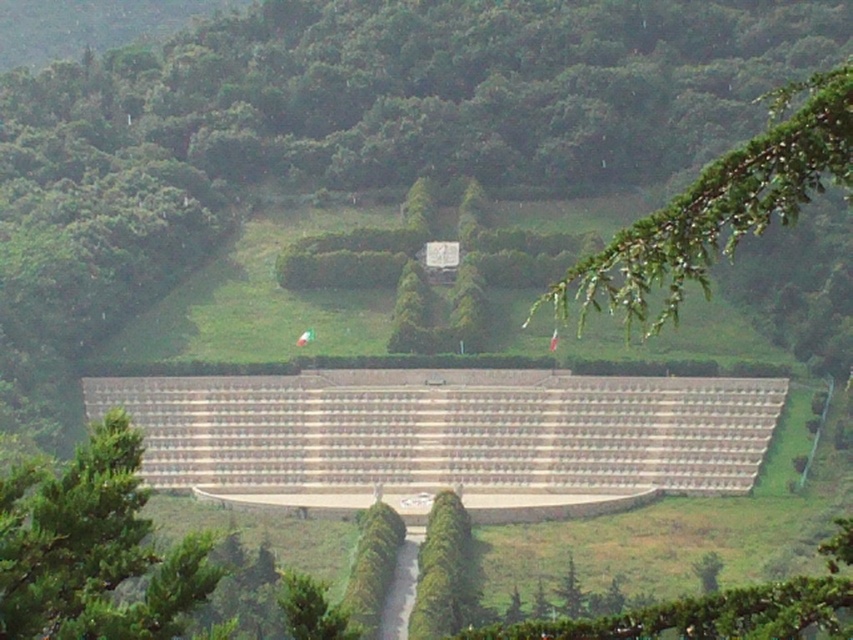
Question: Can you confirm if green needle-like leaves at upper right is positioned above green leafy tree at center?

Choices:
 (A) yes
 (B) no

Answer: (A)

Question: Which of the following is the farthest from the observer?

Choices:
 (A) (815, 74)
 (B) (460, 573)
 (C) (125, 436)

Answer: (A)

Question: From the image, what is the correct spatial relationship of green needle-like leaves at upper right in relation to green leafy tree at center?

Choices:
 (A) above
 (B) below

Answer: (A)

Question: Which point is closer to the camera taking this photo?

Choices:
 (A) (62, 484)
 (B) (456, 572)

Answer: (A)

Question: Estimate the real-world distances between objects in this image. Which object is closer to the green textured tree at center?

Choices:
 (A) green leafy tree at center
 (B) green needle-like leaves at upper right

Answer: (A)

Question: Does green needle-like leaves at upper right have a smaller size compared to green leafy tree at center?

Choices:
 (A) yes
 (B) no

Answer: (B)